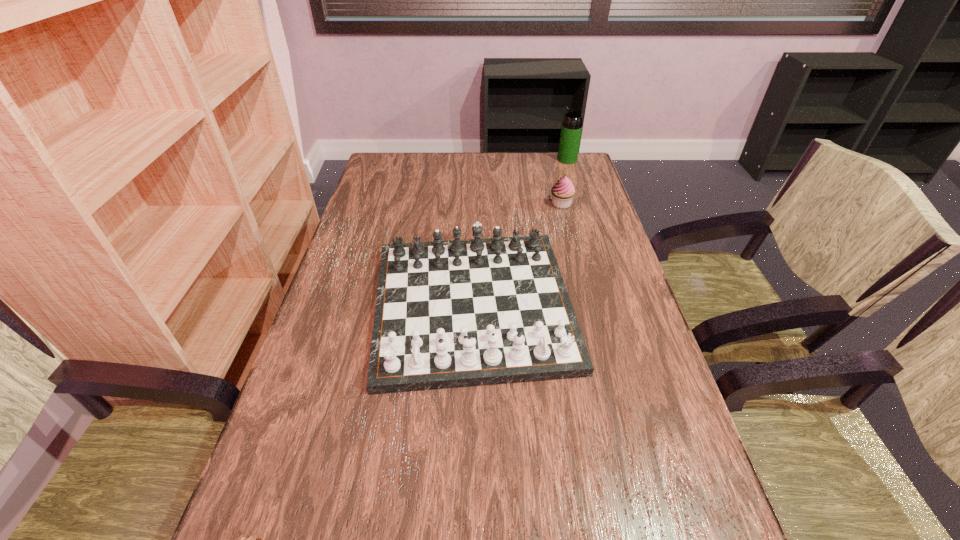
The image size is (960, 540). In order to click on thermos bottle in this screenshot , I will do `click(571, 128)`.

You are a GUI agent. You are given a task and a screenshot of the screen. Output one action in this format:
    pyautogui.click(x=<x>, y=<y>)
    Task: Click on the tallest object
    
    Given the screenshot: What is the action you would take?
    pyautogui.click(x=571, y=128)

Where is `the third farthest object`? the third farthest object is located at coordinates [x=460, y=313].

The image size is (960, 540). Find the location of `the third nearest object`. the third nearest object is located at coordinates (563, 191).

The width and height of the screenshot is (960, 540). Find the location of `free space located 0.380m from the spout of the tallest object`. free space located 0.380m from the spout of the tallest object is located at coordinates click(x=454, y=159).

This screenshot has height=540, width=960. I want to click on free space located 0.100m from the spout of the tallest object, so click(530, 159).

This screenshot has height=540, width=960. I want to click on free space located from the spout of the tallest object, so pos(536,159).

Where is `blank space located on the back of the second nearest object`? The height and width of the screenshot is (540, 960). blank space located on the back of the second nearest object is located at coordinates (475, 182).

Locate an element on the screen. blank area located 0.140m on the left of the cupcake is located at coordinates (506, 204).

Find the location of a particular element. This screenshot has width=960, height=540. object that is at the far edge is located at coordinates (571, 128).